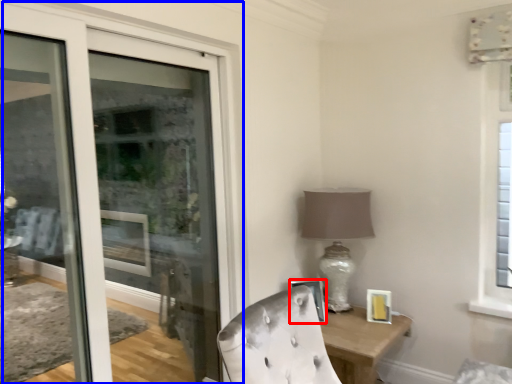
Question: Which object is further to the camera taking this photo, picture frame (highlighted by a red box) or door (highlighted by a blue box)?

Choices:
 (A) picture frame
 (B) door

Answer: (A)